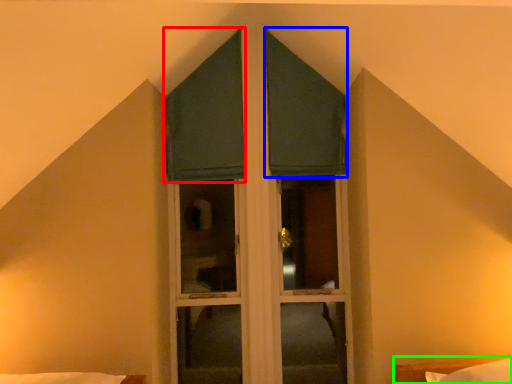
Question: Which object is positioned farthest from curtain (highlighted by a red box)? Select from curtain (highlighted by a blue box) and bed (highlighted by a green box).

Choices:
 (A) curtain
 (B) bed

Answer: (B)